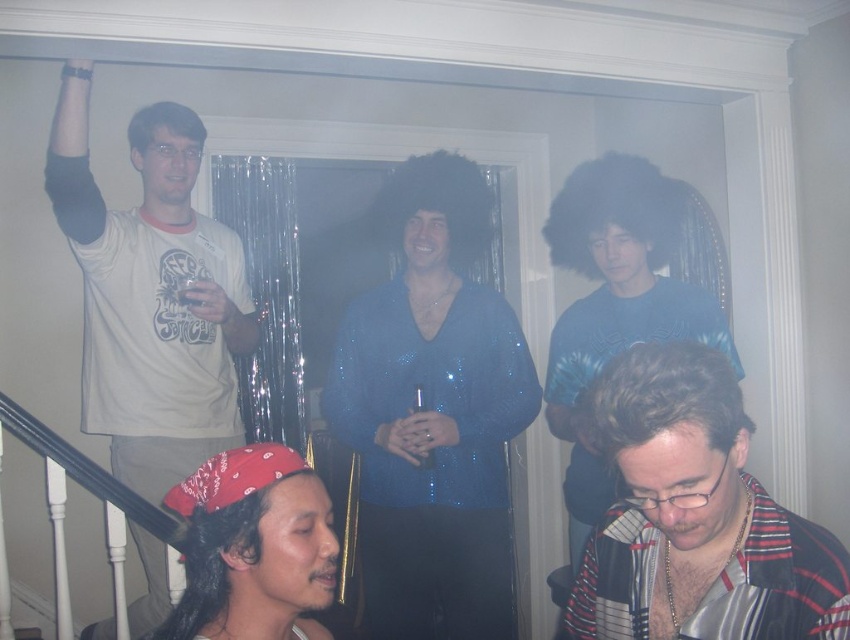
Is sparkly blue shirt at center to the left of striped fabric shirt at lower right from the viewer's perspective?

Yes, sparkly blue shirt at center is to the left of striped fabric shirt at lower right.

Is sparkly blue shirt at center smaller than striped fabric shirt at lower right?

No, sparkly blue shirt at center is not smaller than striped fabric shirt at lower right.

You are a GUI agent. You are given a task and a screenshot of the screen. Output one action in this format:
    pyautogui.click(x=<x>, y=<y>)
    Task: Click on the sparkly blue shirt at center
    The height and width of the screenshot is (640, 850).
    Given the screenshot: What is the action you would take?
    pyautogui.click(x=432, y=413)

The width and height of the screenshot is (850, 640). Find the location of `sparkly blue shirt at center`. sparkly blue shirt at center is located at coordinates (432, 413).

Find the location of a particular element. The height and width of the screenshot is (640, 850). white matte t-shirt at upper left is located at coordinates (151, 294).

Which of these two, white matte t-shirt at upper left or striped fabric shirt at lower right, stands taller?

white matte t-shirt at upper left

Image resolution: width=850 pixels, height=640 pixels. What do you see at coordinates (151, 294) in the screenshot? I see `white matte t-shirt at upper left` at bounding box center [151, 294].

Locate an element on the screen. This screenshot has height=640, width=850. white matte t-shirt at upper left is located at coordinates (151, 294).

Does point (486, 200) come farther from viewer compared to point (588, 368)?

Yes, point (486, 200) is farther from viewer.

Where is `sparkly blue shirt at center`? sparkly blue shirt at center is located at coordinates (432, 413).